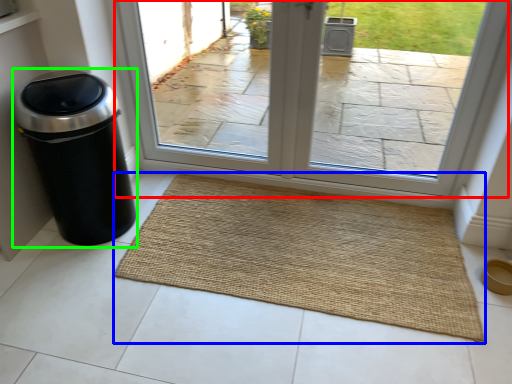
Question: Estimate the real-world distances between objects in this image. Which object is closer to window (highlighted by a red box), mat (highlighted by a blue box) or waste container (highlighted by a green box)?

Choices:
 (A) mat
 (B) waste container

Answer: (A)